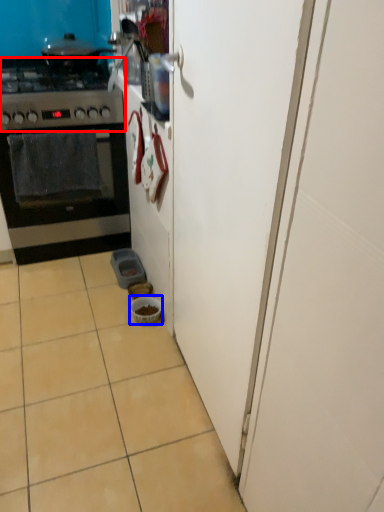
Question: Which object is closer to the camera taking this photo, gas stove (highlighted by a red box) or bowl (highlighted by a blue box)?

Choices:
 (A) gas stove
 (B) bowl

Answer: (A)